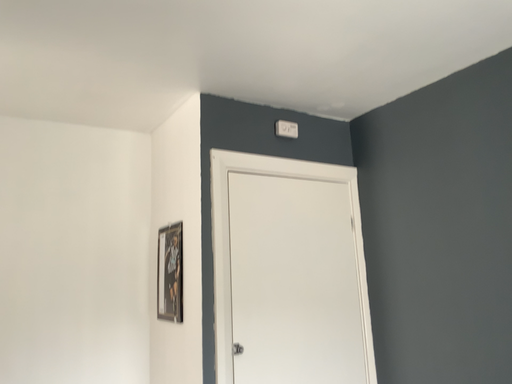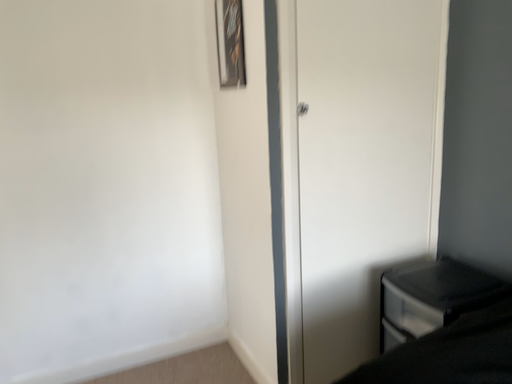
Question: Which way did the camera rotate in the video?

Choices:
 (A) rotated upward
 (B) rotated downward

Answer: (B)